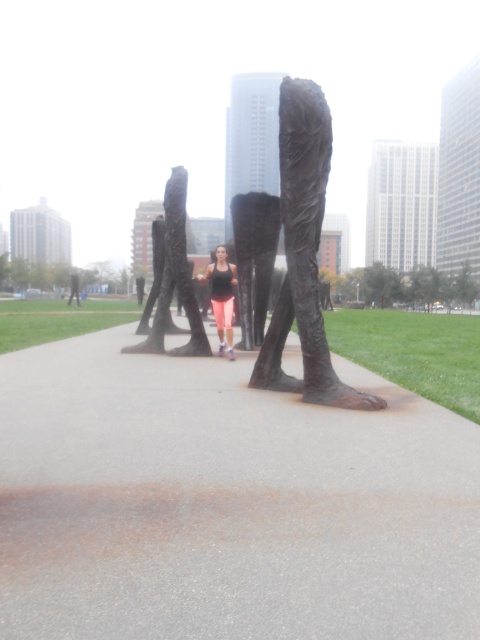
Does bronze/sculpture at center lie behind matte black tank top at center?

No, bronze/sculpture at center is in front of matte black tank top at center.

Who is taller, bronze/sculpture at center or matte black tank top at center?

bronze/sculpture at center

I want to click on bronze/sculpture at center, so click(x=303, y=253).

Between gray concrete pavement at center and bronze/sculpture at center, which one appears on the left side from the viewer's perspective?

gray concrete pavement at center

The width and height of the screenshot is (480, 640). I want to click on gray concrete pavement at center, so click(x=227, y=502).

Does point (116, 579) come in front of point (269, 340)?

That is True.

Locate an element on the screen. The height and width of the screenshot is (640, 480). gray concrete pavement at center is located at coordinates (227, 502).

Does gray concrete pavement at center appear on the right side of bronze statue at center?

Indeed, gray concrete pavement at center is positioned on the right side of bronze statue at center.

At what (x,y) coordinates should I click in order to perform the action: click on gray concrete pavement at center. Please return your answer as a coordinate pair (x, y). The image size is (480, 640). Looking at the image, I should click on (227, 502).

Who is more forward, (311, 557) or (195, 304)?

Point (311, 557)

Find the location of a particular element. This screenshot has width=480, height=640. gray concrete pavement at center is located at coordinates (227, 502).